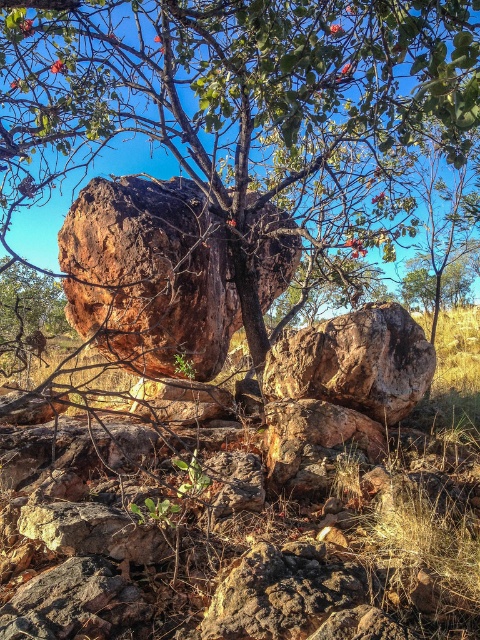
You are standing at a point 19.95 feet away from the point labeled point (251, 349) in the image. If you want to walk directly towards that point, which direction should you head? Please provide your answer in terms of cardinal directions like north, south, east, or west.

The point labeled point (251, 349) is located in the center of the frame where the tree with thin branches and sparse green leaves stands. Since you are 19.95 feet away from it, you should head directly towards the center of the image where the tree is located to reach the point.

You are a geologist examining the rocks in the image. You notice two rocks labeled as the rusty brown rock at center and the rustic brown rock at center. Which rock is located above the other?

The rusty brown rock at center is positioned over the rustic brown rock at center.